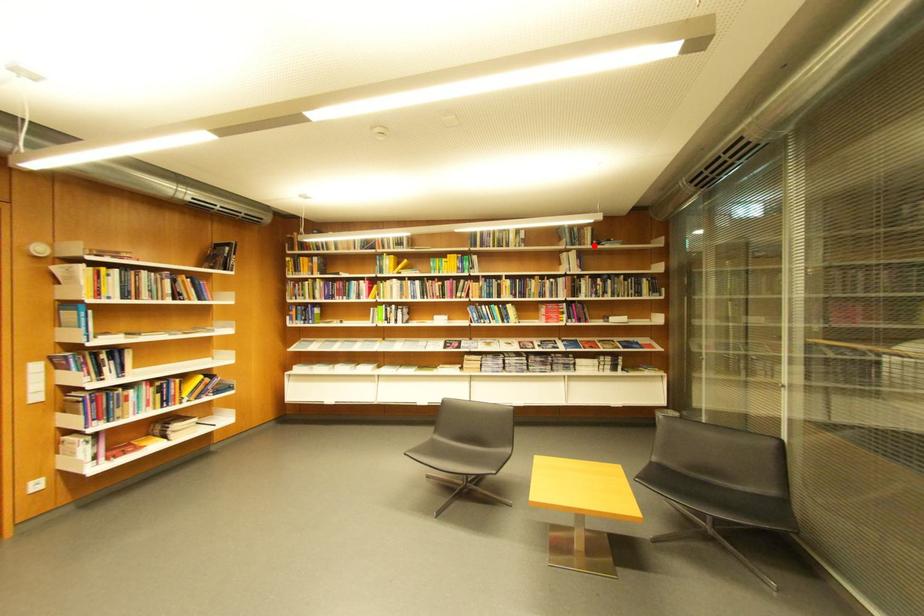
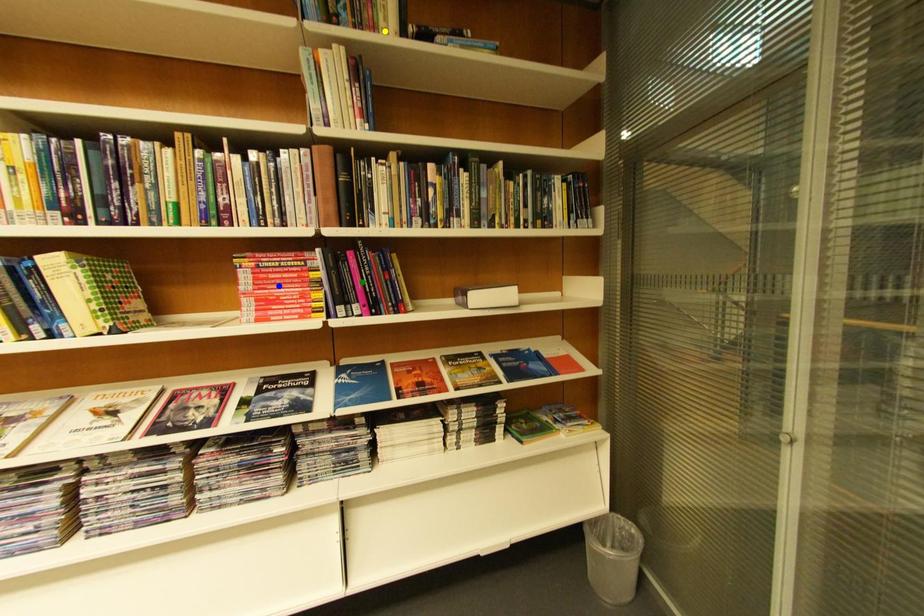
Question: I am providing you with two images of the same scene from different viewpoints. A red point is marked on the first image. You are given multiple points on the second image. Can you choose the point in image 2 that corresponds to the point in image 1?

Choices:
 (A) green point
 (B) blue point
 (C) yellow point

Answer: (C)